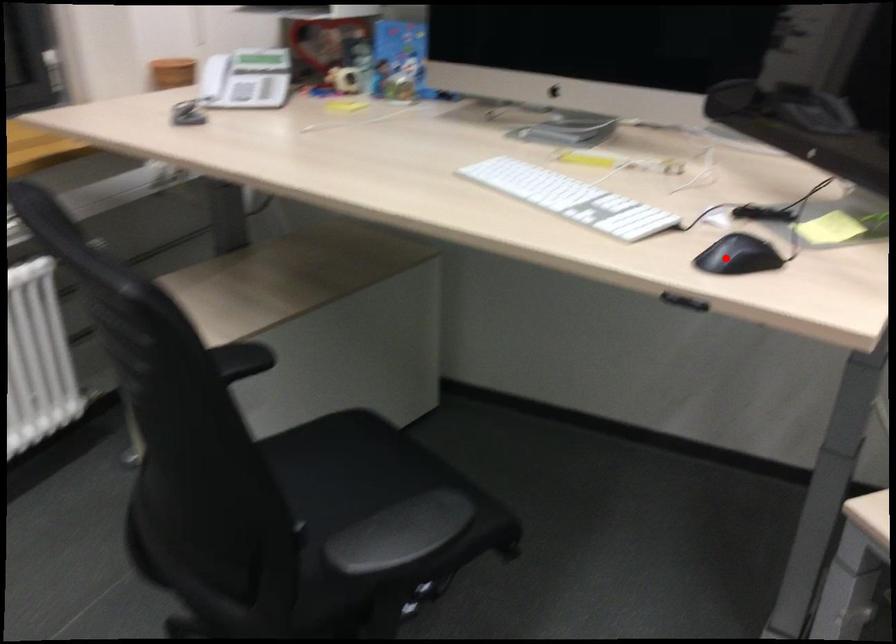
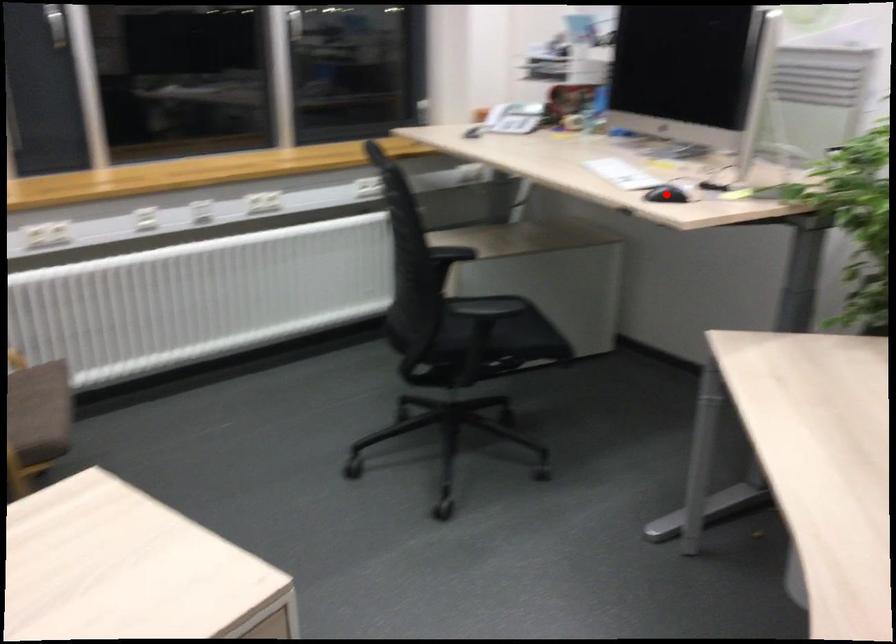
I am providing you with two images of the same scene from different viewpoints. A red point is marked on the first image and another point is marked on the second image. Are the points marked in image1 and image2 representing the same 3D position?

Yes